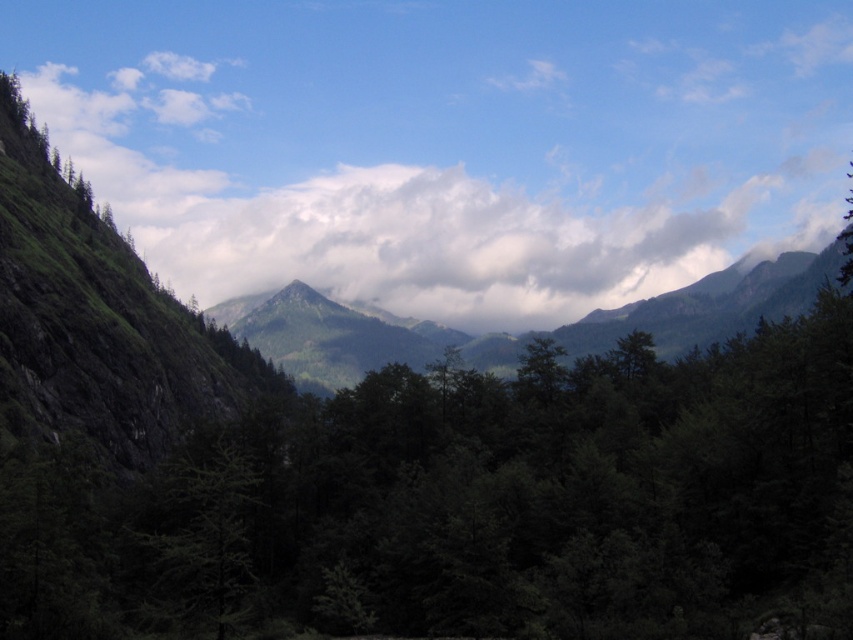
You are planning to take a photo of the green matte tree at center and the green matte mountain at center. Which object will appear narrower in the photo?

The green matte tree at center will appear narrower in the photo because it has a lesser width compared to the green matte mountain at center.